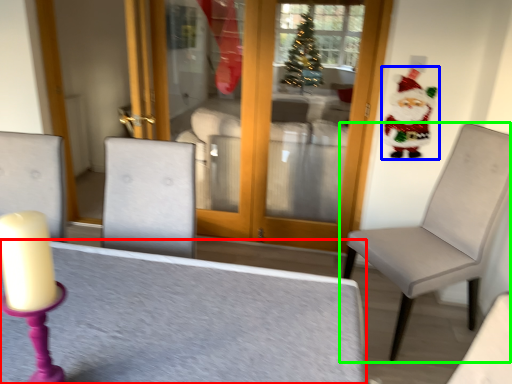
Question: Estimate the real-world distances between objects in this image. Which object is farther from table (highlighted by a red box), santa claus (highlighted by a blue box) or chair (highlighted by a green box)?

Choices:
 (A) santa claus
 (B) chair

Answer: (A)